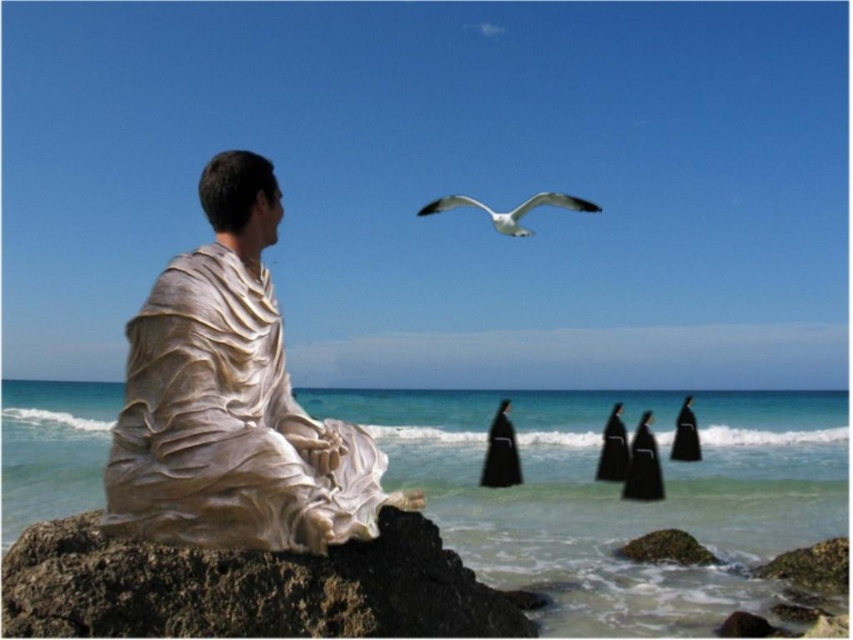
Does matte white statue at left appear under white glossy seagull at upper center?

Yes, matte white statue at left is below white glossy seagull at upper center.

Is matte white statue at left thinner than white glossy seagull at upper center?

Correct, matte white statue at left's width is less than white glossy seagull at upper center's.

Identify the location of matte white statue at left. (230, 401).

Is clear blue water at lower center taller than matte white statue at left?

Indeed, clear blue water at lower center has a greater height compared to matte white statue at left.

The height and width of the screenshot is (640, 853). What do you see at coordinates (616, 496) in the screenshot? I see `clear blue water at lower center` at bounding box center [616, 496].

Who is more distant from viewer, (39, 476) or (184, 332)?

The point (39, 476) is more distant.

Find the location of `clear blue water at lower center`. clear blue water at lower center is located at coordinates (616, 496).

Who is positioned more to the right, clear blue water at lower center or white glossy seagull at upper center?

From the viewer's perspective, white glossy seagull at upper center appears more on the right side.

Is point (701, 538) closer to camera compared to point (547, 198)?

That is True.

I want to click on clear blue water at lower center, so click(x=616, y=496).